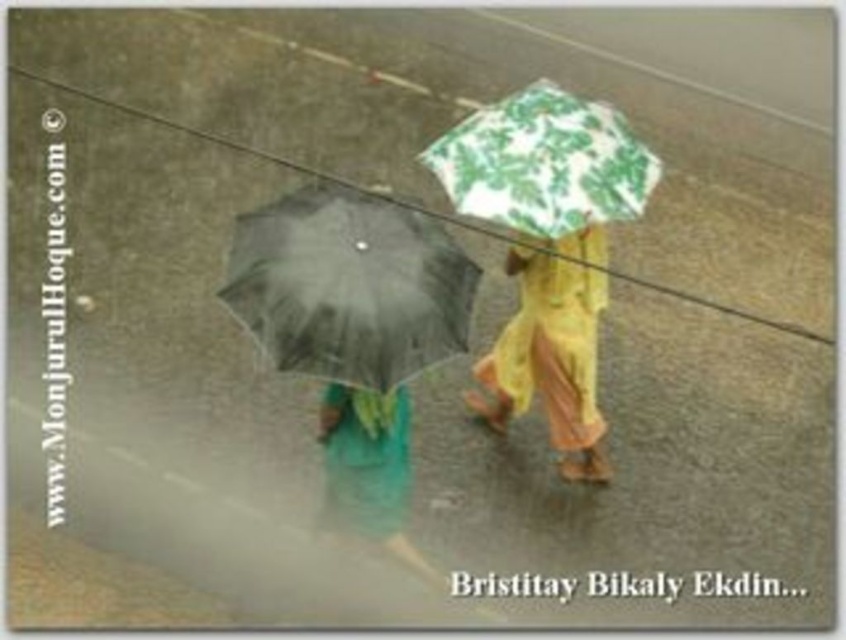
You are standing at the origin point of the coordinate system. The black matte umbrella at left is represented by point [349,285]. Can you determine the direction of the black matte umbrella at left relative to your position?

The black matte umbrella at left is located at coordinates [349,285]. Since the x and y coordinates are both positive, the black matte umbrella at left is northeast of your position.

You are a photographer trying to capture both the black matte umbrella at left and the yellow fabric umbrella at upper center in a single frame. Given their sizes, which umbrella will appear larger in the photo?

The black matte umbrella at left appears larger in the photo because its width surpasses that of the yellow fabric umbrella at upper center.